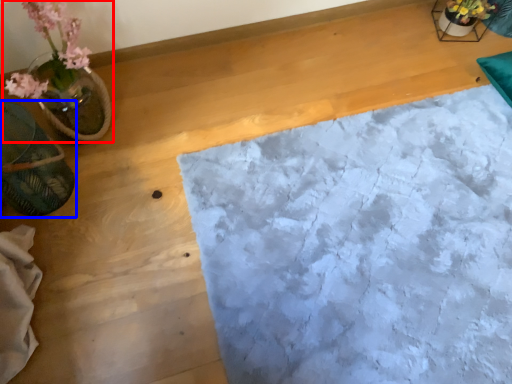
Question: Among these objects, which one is farthest to the camera, houseplant (highlighted by a red box) or flowerpot (highlighted by a blue box)?

Choices:
 (A) houseplant
 (B) flowerpot

Answer: (B)